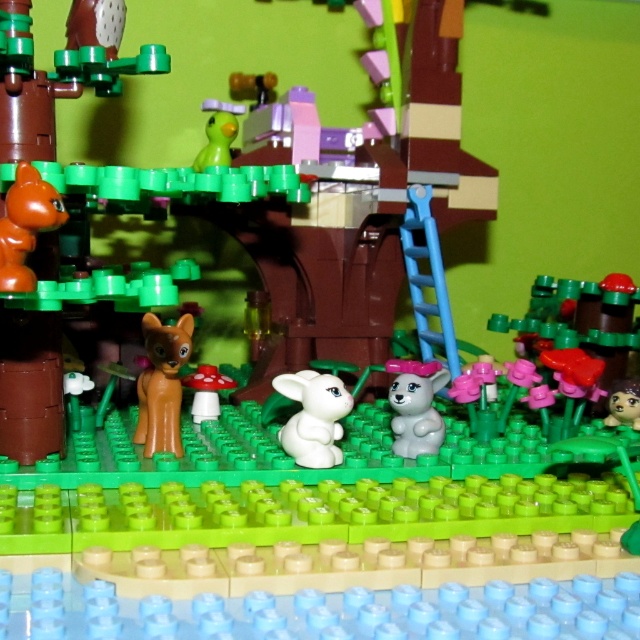
Question: Is brown matte deer at center above orange matte cat at left?

Choices:
 (A) no
 (B) yes

Answer: (A)

Question: In this image, where is brown matte deer at center located relative to brown matte rabbit at center?

Choices:
 (A) left
 (B) right

Answer: (A)

Question: Which point appears closest to the camera in this image?

Choices:
 (A) (58, 205)
 (B) (442, 435)

Answer: (A)

Question: Is brown matte deer at center to the right of white glossy rabbit at center from the viewer's perspective?

Choices:
 (A) no
 (B) yes

Answer: (A)

Question: Considering the real-world distances, which object is farthest from the white matte rabbit at center?

Choices:
 (A) brown matte rabbit at center
 (B) white glossy rabbit at center
 (C) brown matte deer at center
 (D) orange matte cat at left

Answer: (D)

Question: Which object is closer to the camera taking this photo?

Choices:
 (A) brown matte rabbit at center
 (B) brown matte deer at center

Answer: (B)